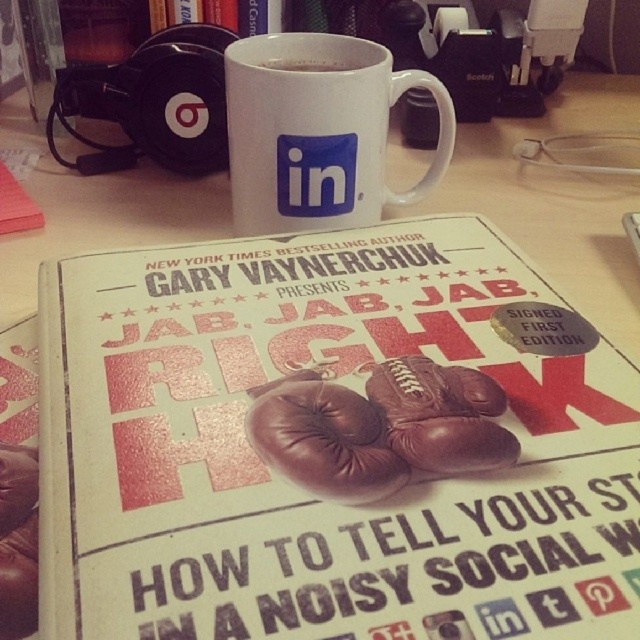
You are organizing a presentation and need to place a new item on the desk. You have a small box that needs to be placed between the white matte poster at center and the brown leather boxing glove at center. Can you do this without moving either object?

The white matte poster at center is in front of the brown leather boxing glove at center, so there is no space between them. You cannot place the box between them without moving at least one of the objects.

You are organizing a presentation and need to place a white matte poster at center and a brown leather boxing glove at center on a desk. The desk has limited space. Can you fit both items on the desk without overlapping?

The white matte poster at center and brown leather boxing glove at center are 3.74 inches apart from each other, so they can be placed on the desk without overlapping as long as there is at least 3.74 inches of space between them.

You are organizing a bookshelf and need to place the white ceramic mug at center and the brown leather boxing glove at center next to each other. Which object should you place first if you want to ensure they fit side by side without overlapping?

The white ceramic mug at center has a larger width than the brown leather boxing glove at center, so you should place the white ceramic mug at center first to ensure they fit side by side without overlapping.